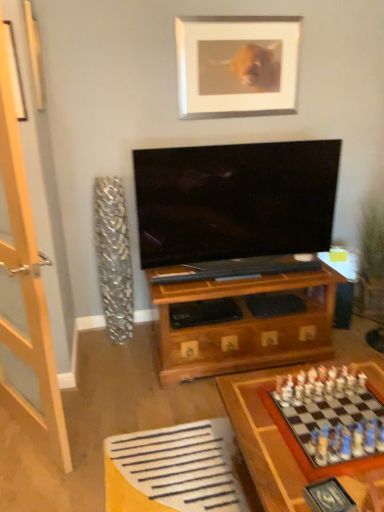
Question: Which is correct: wooden chess set at lower right is inside wooden chessboard at lower right, or outside of it?

Choices:
 (A) inside
 (B) outside

Answer: (A)

Question: Based on their sizes in the image, would you say wooden chess set at lower right is bigger or smaller than wooden chessboard at lower right?

Choices:
 (A) big
 (B) small

Answer: (B)

Question: Which object is positioned farthest from the wooden chess set at lower right?

Choices:
 (A) wooden chessboard at lower right
 (B) clear glass door at left
 (C) silver metallic picture frame at upper center

Answer: (C)

Question: Which of these objects is positioned closest to the clear glass door at left?

Choices:
 (A) silver metallic picture frame at upper center
 (B) wooden chess set at lower right
 (C) wooden chessboard at lower right

Answer: (C)